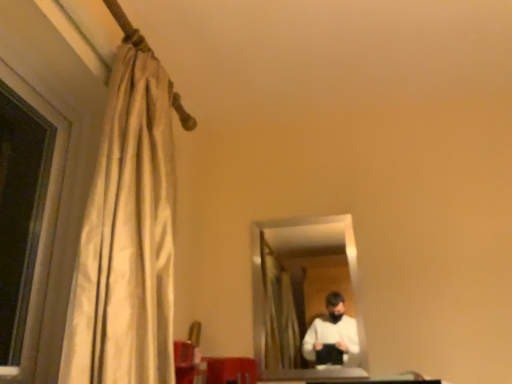
Question: Can you confirm if beige fabric curtain at left is smaller than clear glass mirror at center?

Choices:
 (A) yes
 (B) no

Answer: (B)

Question: From the image's perspective, is beige fabric curtain at left over clear glass mirror at center?

Choices:
 (A) yes
 (B) no

Answer: (A)

Question: Is beige fabric curtain at left far from clear glass mirror at center?

Choices:
 (A) no
 (B) yes

Answer: (B)

Question: Does beige fabric curtain at left have a lesser height compared to clear glass mirror at center?

Choices:
 (A) yes
 (B) no

Answer: (B)

Question: From a real-world perspective, is beige fabric curtain at left over clear glass mirror at center?

Choices:
 (A) no
 (B) yes

Answer: (B)

Question: From the image's perspective, does beige fabric curtain at left appear lower than clear glass mirror at center?

Choices:
 (A) yes
 (B) no

Answer: (B)

Question: Is beige fabric curtain at left located within clear glass mirror at center?

Choices:
 (A) yes
 (B) no

Answer: (B)

Question: From the image's perspective, does clear glass mirror at center appear lower than beige fabric curtain at left?

Choices:
 (A) yes
 (B) no

Answer: (A)

Question: Is clear glass mirror at center facing towards beige fabric curtain at left?

Choices:
 (A) no
 (B) yes

Answer: (B)

Question: From a real-world perspective, is clear glass mirror at center beneath beige fabric curtain at left?

Choices:
 (A) no
 (B) yes

Answer: (B)

Question: Can you see clear glass mirror at center touching beige fabric curtain at left?

Choices:
 (A) no
 (B) yes

Answer: (A)

Question: Does clear glass mirror at center lie behind beige fabric curtain at left?

Choices:
 (A) yes
 (B) no

Answer: (A)

Question: Relative to beige fabric curtain at left, is clear glass mirror at center in front or behind?

Choices:
 (A) behind
 (B) front

Answer: (A)